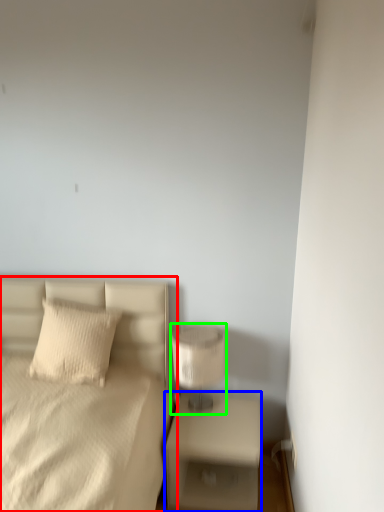
Question: Based on their relative distances, which object is farther from bed (highlighted by a red box)? Choose from nightstand (highlighted by a blue box) and table lamp (highlighted by a green box).

Choices:
 (A) nightstand
 (B) table lamp

Answer: (A)